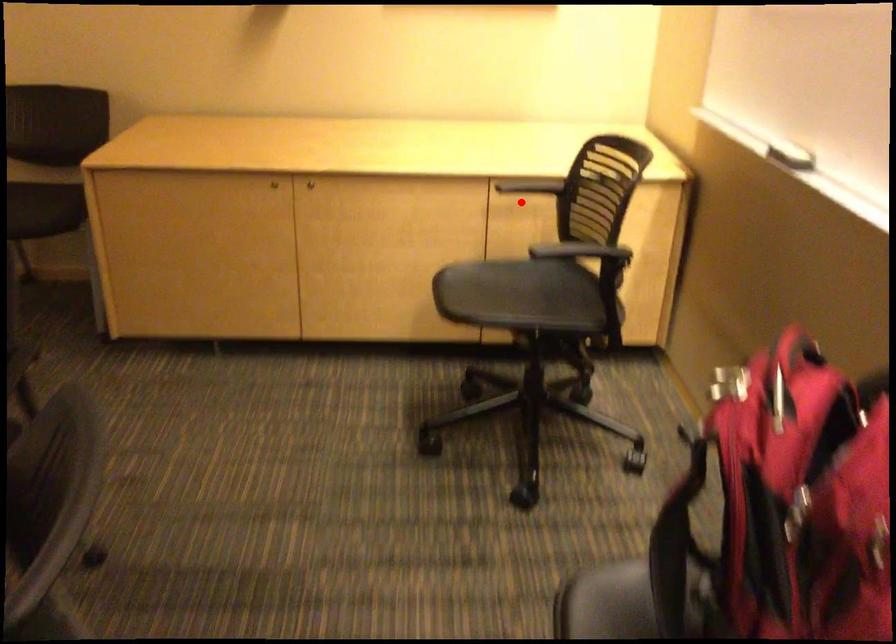
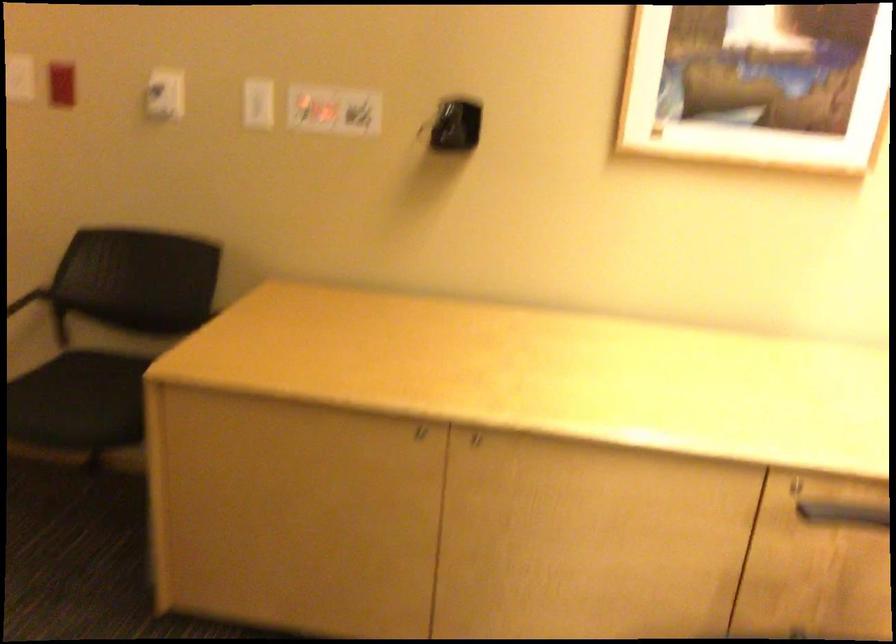
The point at the highlighted location is marked in the first image. Where is the corresponding point in the second image?

(828, 507)